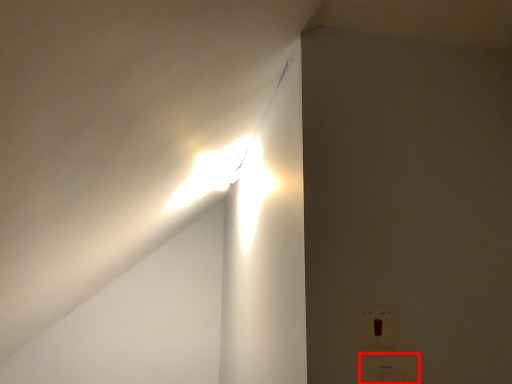
Question: Considering the relative positions of electric outlet (annotated by the red box) and electric outlet in the image provided, where is electric outlet (annotated by the red box) located with respect to the staircase?

Choices:
 (A) right
 (B) left

Answer: (A)